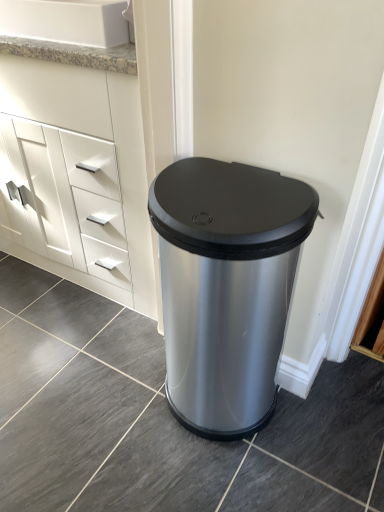
The height and width of the screenshot is (512, 384). In order to click on white granite sink at upper left in this screenshot , I will do `click(66, 21)`.

Is white matte cabinet at left oriented away from satin silver trash can at center?

That's not correct — white matte cabinet at left is not looking away from satin silver trash can at center.

From the image's perspective, between white matte cabinet at left and satin silver trash can at center, who is located below?

satin silver trash can at center.

From a real-world perspective, who is located lower, white matte cabinet at left or satin silver trash can at center?

satin silver trash can at center is physically lower.

Visually, is white matte cabinet at left positioned to the left or to the right of satin silver trash can at center?

Based on their positions, white matte cabinet at left is located to the left of satin silver trash can at center.

Can you confirm if white granite sink at upper left is taller than satin silver trash can at center?

No, white granite sink at upper left is not taller than satin silver trash can at center.

Does point (113, 10) come in front of point (274, 395)?

Yes, it is in front of point (274, 395).

In the scene shown: Between white granite sink at upper left and satin silver trash can at center, which one has larger size?

With larger size is satin silver trash can at center.

Measure the distance between white granite sink at upper left and satin silver trash can at center.

25.53 inches.

From a real-world perspective, is white matte cabinet at left above or below white granite sink at upper left?

In terms of real-world spatial position, white matte cabinet at left is below white granite sink at upper left.

Can you tell me how much white matte cabinet at left and white granite sink at upper left differ in facing direction?

The facing directions of white matte cabinet at left and white granite sink at upper left are 0.000347 degrees apart.

Does white matte cabinet at left have a greater height compared to white granite sink at upper left?

Indeed, white matte cabinet at left has a greater height compared to white granite sink at upper left.

From the image's perspective, between white matte cabinet at left and white granite sink at upper left, who is located below?

white matte cabinet at left.

From a real-world perspective, which object rests below the other?

white matte cabinet at left, from a real-world perspective.

Is white granite sink at upper left not close to white matte cabinet at left?

white granite sink at upper left is actually quite close to white matte cabinet at left.

Is white granite sink at upper left aimed at white matte cabinet at left?

No, white granite sink at upper left is not turned towards white matte cabinet at left.

You are a GUI agent. You are given a task and a screenshot of the screen. Output one action in this format:
    pyautogui.click(x=<x>, y=<y>)
    Task: Click on the chest of drawers that is in front of the white granite sink at upper left
    The image size is (384, 512).
    Given the screenshot: What is the action you would take?
    pyautogui.click(x=78, y=175)

Considering the relative sizes of satin silver trash can at center and white granite sink at upper left in the image provided, is satin silver trash can at center taller than white granite sink at upper left?

Yes, satin silver trash can at center is taller than white granite sink at upper left.

The width and height of the screenshot is (384, 512). Find the location of `sink above the satin silver trash can at center (from the image's perspective)`. sink above the satin silver trash can at center (from the image's perspective) is located at coordinates (66, 21).

Looking at this image, is satin silver trash can at center turned away from white granite sink at upper left?

No, satin silver trash can at center is not facing away from white granite sink at upper left.

Does point (280, 321) appear closer or farther from the camera than point (5, 28)?

Point (280, 321) is closer to the camera than point (5, 28).

Is satin silver trash can at center facing towards white matte cabinet at left?

No, satin silver trash can at center is not aimed at white matte cabinet at left.

You are a GUI agent. You are given a task and a screenshot of the screen. Output one action in this format:
    pyautogui.click(x=<x>, y=<y>)
    Task: Click on the chest of drawers above the satin silver trash can at center (from the image's perspective)
    
    Given the screenshot: What is the action you would take?
    pyautogui.click(x=78, y=175)

Is satin silver trash can at center wider or thinner than white matte cabinet at left?

Clearly, satin silver trash can at center has less width compared to white matte cabinet at left.

Based on their positions, is satin silver trash can at center located to the left or right of white matte cabinet at left?

satin silver trash can at center is positioned on white matte cabinet at left's right side.

Identify the location of waste container on the right of white matte cabinet at left. This screenshot has height=512, width=384. (227, 286).

Identify the location of waste container in front of the white granite sink at upper left. The image size is (384, 512). (227, 286).

From the image, which object appears to be farther from white granite sink at upper left, satin silver trash can at center or white matte cabinet at left?

The object further to white granite sink at upper left is satin silver trash can at center.

Considering their positions, is white granite sink at upper left positioned closer to satin silver trash can at center than white matte cabinet at left?

white matte cabinet at left.

Based on their spatial positions, is white granite sink at upper left or satin silver trash can at center further from white matte cabinet at left?

satin silver trash can at center lies further to white matte cabinet at left than the other object.

Estimate the real-world distances between objects in this image. Which object is closer to white granite sink at upper left, white matte cabinet at left or satin silver trash can at center?

The object closer to white granite sink at upper left is white matte cabinet at left.

When comparing their distances from white matte cabinet at left, does satin silver trash can at center or white granite sink at upper left seem closer?

Among the two, white granite sink at upper left is located nearer to white matte cabinet at left.

From the image, which object appears to be farther from satin silver trash can at center, white matte cabinet at left or white granite sink at upper left?

The object further to satin silver trash can at center is white granite sink at upper left.

Identify the location of the chest of drawers that lies between white granite sink at upper left and satin silver trash can at center from top to bottom. The width and height of the screenshot is (384, 512). (78, 175).